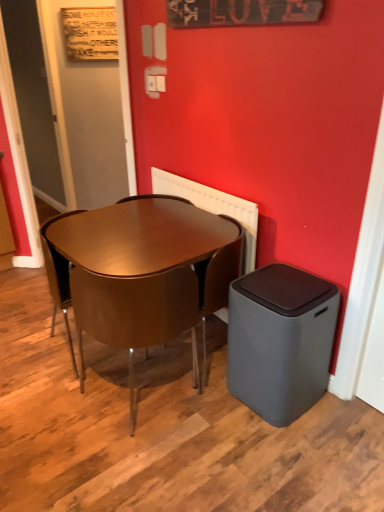
This screenshot has height=512, width=384. I want to click on vacant point above brown glossy chair at center, acting as the 1th chair starting from the right (from a real-world perspective), so click(x=207, y=226).